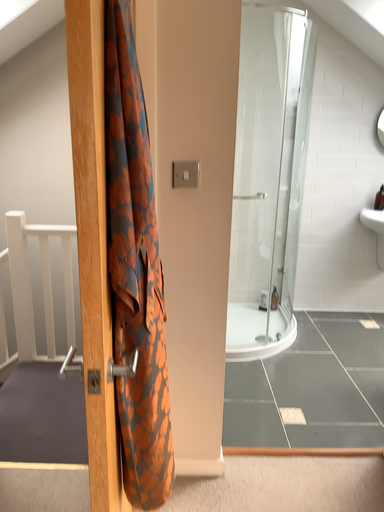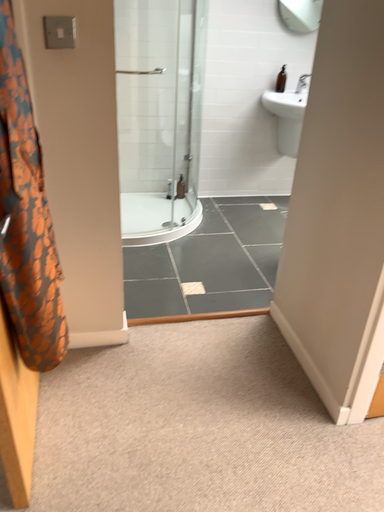
Question: How did the camera likely rotate when shooting the video?

Choices:
 (A) rotated downward
 (B) rotated upward

Answer: (A)